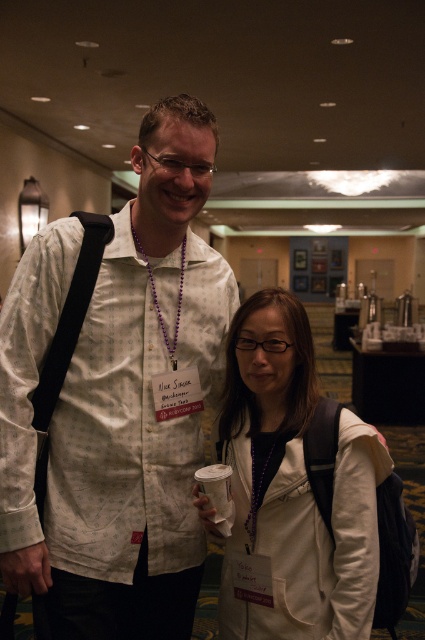
Question: Which of the following is the farthest from the observer?

Choices:
 (A) white matte jacket at center
 (B) white printed shirt at center

Answer: (B)

Question: Which object is farther from the camera taking this photo?

Choices:
 (A) purple beaded necklace at center
 (B) white printed shirt at center
 (C) white matte jacket at center

Answer: (A)

Question: Which of these objects is positioned farthest from the purple beaded necklace at center?

Choices:
 (A) white matte jacket at center
 (B) white printed shirt at center

Answer: (A)

Question: Does white printed shirt at center have a lesser width compared to white matte jacket at center?

Choices:
 (A) no
 (B) yes

Answer: (A)

Question: Observing the image, what is the correct spatial positioning of white printed shirt at center in reference to purple beaded necklace at center?

Choices:
 (A) left
 (B) right

Answer: (A)

Question: Does white matte jacket at center have a larger size compared to purple beaded necklace at center?

Choices:
 (A) yes
 (B) no

Answer: (A)